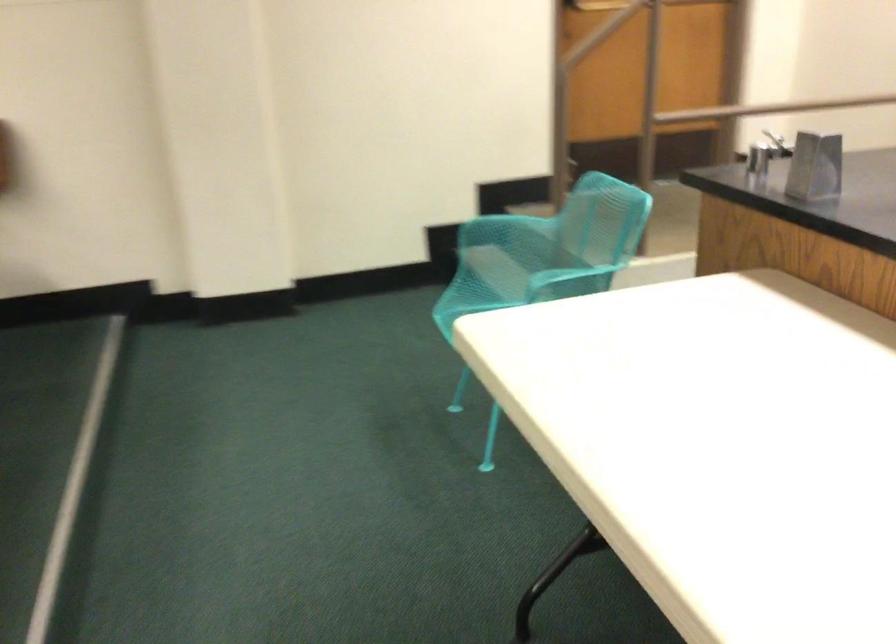
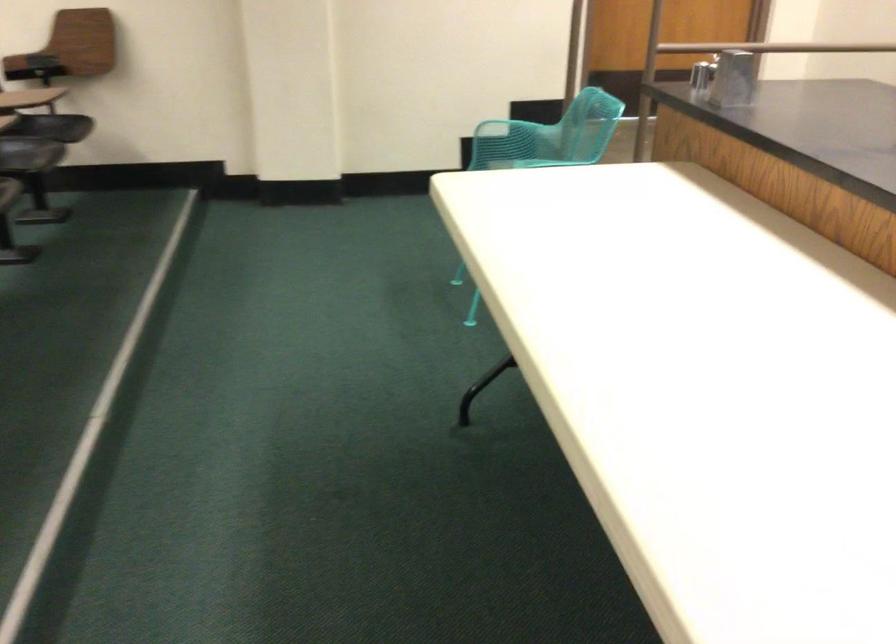
Where in the second image is the point corresponding to (503,189) from the first image?

(533, 111)